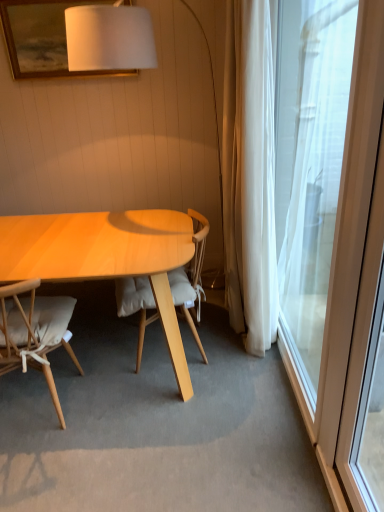
Question: Looking at their shapes, would you say transparent glass window at right is wider or thinner than light brown wood chair at left, which ranks as the second chair in right-to-left order?

Choices:
 (A) wide
 (B) thin

Answer: (B)

Question: From a real-world perspective, is transparent glass window at right positioned above or below light brown wood chair at left, which ranks as the second chair in right-to-left order?

Choices:
 (A) above
 (B) below

Answer: (A)

Question: Which of these objects is positioned closest to the light brown wood chair at left, which ranks as the second chair in right-to-left order?

Choices:
 (A) transparent glass window at right
 (B) white matte picture frame at upper center
 (C) light wood/wooden chair at center, the 2th chair in the left-to-right sequence

Answer: (C)

Question: Based on their relative distances, which object is farther from the light wood/wooden chair at center, the 1th chair viewed from the right?

Choices:
 (A) light brown wood chair at left, acting as the first chair starting from the left
 (B) transparent glass window at right
 (C) white matte picture frame at upper center

Answer: (C)